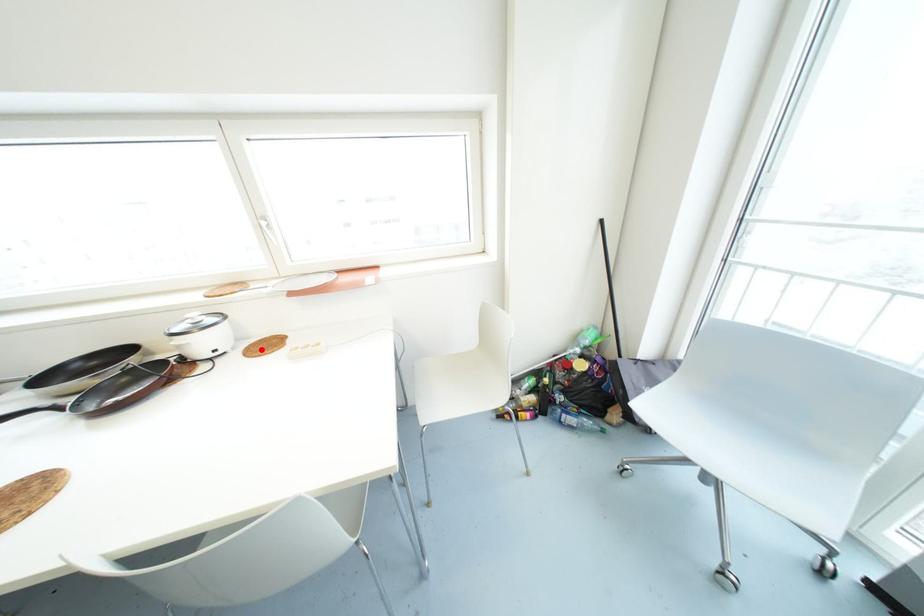
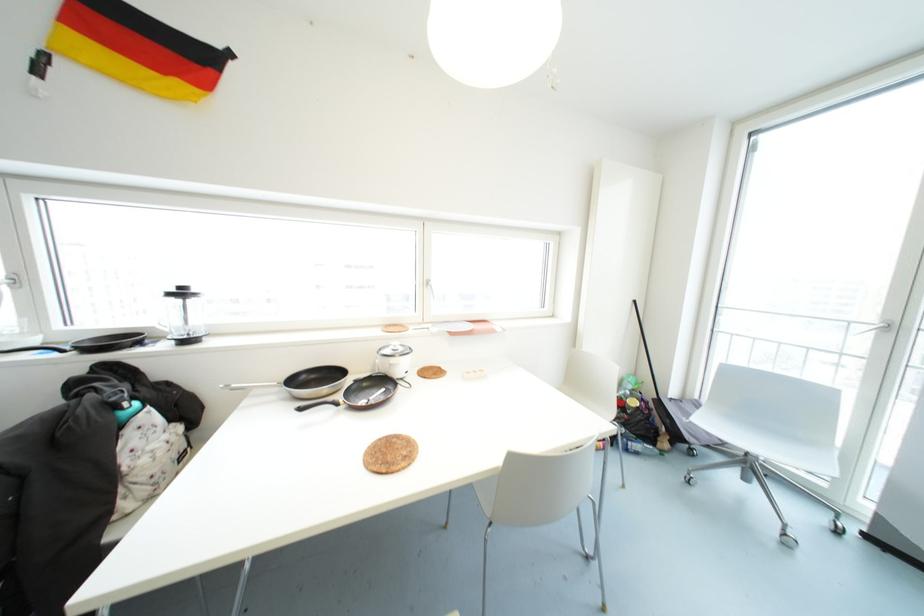
Locate, in the second image, the point that corresponds to the highlighted location in the first image.

(434, 374)